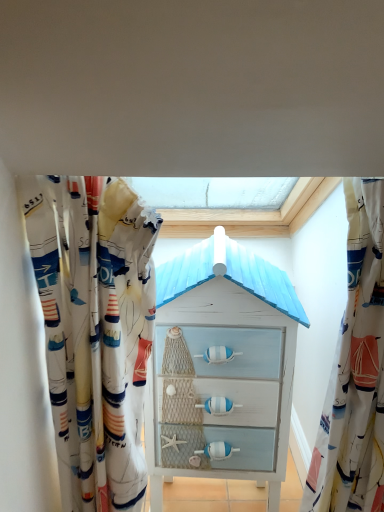
At what (x,y) coordinates should I click in order to perform the action: click on white fabric curtain at left, the 2th curtain from the right. Please return your answer as a coordinate pair (x, y). The height and width of the screenshot is (512, 384). Looking at the image, I should click on (96, 326).

Locate an element on the screen. The width and height of the screenshot is (384, 512). white painted wood chest of drawers at center is located at coordinates (x=222, y=369).

Find the location of a particular element. the chest of drawers that is below the white fabric curtain at left, the 2th curtain from the right (from the image's perspective) is located at coordinates (222, 369).

Is white fabric curtain at left, the 2th curtain from the right, outside of white painted wood chest of drawers at center?

white fabric curtain at left, the 2th curtain from the right, is positioned outside white painted wood chest of drawers at center.

From a real-world perspective, who is located higher, white fabric curtain at left, the 2th curtain from the right, or white painted wood chest of drawers at center?

In real-world perspective, white fabric curtain at left, the 2th curtain from the right, is above.

Is point (108, 297) positioned after point (202, 393)?

No, (108, 297) is closer to viewer.

Is white painted wood chest of drawers at center oriented away from white fabric curtain at left, the first curtain from the left?

No.

Looking at this image, is white fabric curtain at left, the first curtain from the left, a part of white painted wood chest of drawers at center?

That's incorrect, white fabric curtain at left, the first curtain from the left, is not inside white painted wood chest of drawers at center.

Which object is positioned more to the right, white painted wood chest of drawers at center or white fabric curtain at left, the 2th curtain from the right?

From the viewer's perspective, white painted wood chest of drawers at center appears more on the right side.

From a real-world perspective, which is physically below, white painted wood chest of drawers at center or white fabric curtain at left, the 2th curtain from the right?

white painted wood chest of drawers at center, from a real-world perspective.

Where is `curtain behind the white fabric curtain at left, the 2th curtain from the right`? curtain behind the white fabric curtain at left, the 2th curtain from the right is located at coordinates (355, 370).

From the picture: From the image's perspective, does white fabric curtain at left, the first curtain from the left, appear higher than white fabric curtain at right, the 2th curtain from the left?

Indeed, from the image's perspective, white fabric curtain at left, the first curtain from the left, is shown above white fabric curtain at right, the 2th curtain from the left.

Is point (136, 452) more distant than point (309, 495)?

No, it is not.

From the image's perspective, is white fabric curtain at right, arranged as the 1th curtain when viewed from the right, on white fabric curtain at left, the 2th curtain from the right?

No, from the image's perspective, white fabric curtain at right, arranged as the 1th curtain when viewed from the right, is not above white fabric curtain at left, the 2th curtain from the right.

Which is correct: white fabric curtain at right, arranged as the 1th curtain when viewed from the right, is inside white fabric curtain at left, the 2th curtain from the right, or outside of it?

white fabric curtain at right, arranged as the 1th curtain when viewed from the right, is spatially situated outside white fabric curtain at left, the 2th curtain from the right.

Is white fabric curtain at right, the 2th curtain from the left, at the left side of white fabric curtain at left, the 2th curtain from the right?

Incorrect, white fabric curtain at right, the 2th curtain from the left, is not on the left side of white fabric curtain at left, the 2th curtain from the right.

Between point (341, 347) and point (105, 492), which one is positioned behind?

Positioned behind is point (105, 492).

From a real-world perspective, is white fabric curtain at right, the 2th curtain from the left, positioned above or below white painted wood chest of drawers at center?

white fabric curtain at right, the 2th curtain from the left, is situated higher than white painted wood chest of drawers at center in the real world.

Which of these two, white fabric curtain at right, arranged as the 1th curtain when viewed from the right, or white painted wood chest of drawers at center, is smaller?

With smaller size is white fabric curtain at right, arranged as the 1th curtain when viewed from the right.

Where is `curtain that is the 1st one when counting forward from the white painted wood chest of drawers at center`? Image resolution: width=384 pixels, height=512 pixels. curtain that is the 1st one when counting forward from the white painted wood chest of drawers at center is located at coordinates (355, 370).

Locate an element on the screen. The width and height of the screenshot is (384, 512). curtain that is the 1st one when counting upward from the white painted wood chest of drawers at center (from the image's perspective) is located at coordinates (355, 370).

Would you consider white painted wood chest of drawers at center to be distant from white fabric curtain at right, the 2th curtain from the left?

No, there isn't a large distance between white painted wood chest of drawers at center and white fabric curtain at right, the 2th curtain from the left.

Between white painted wood chest of drawers at center and white fabric curtain at right, the 2th curtain from the left, which one has smaller size?

white fabric curtain at right, the 2th curtain from the left, is smaller.

What are the coordinates of `curtain that is the 2nd object located above the white painted wood chest of drawers at center (from the image's perspective)` in the screenshot? It's located at (96, 326).

The image size is (384, 512). In order to click on curtain on the left of white painted wood chest of drawers at center in this screenshot , I will do `click(96, 326)`.

Which object lies further to the anchor point white fabric curtain at left, the 2th curtain from the right, white painted wood chest of drawers at center or white fabric curtain at right, arranged as the 1th curtain when viewed from the right?

white fabric curtain at right, arranged as the 1th curtain when viewed from the right, is further to white fabric curtain at left, the 2th curtain from the right.

Estimate the real-world distances between objects in this image. Which object is closer to white painted wood chest of drawers at center, white fabric curtain at left, the 2th curtain from the right, or white fabric curtain at right, the 2th curtain from the left?

Based on the image, white fabric curtain at left, the 2th curtain from the right, appears to be nearer to white painted wood chest of drawers at center.

Which object lies nearer to the anchor point white fabric curtain at left, the 2th curtain from the right, white fabric curtain at right, the 2th curtain from the left, or white painted wood chest of drawers at center?

white painted wood chest of drawers at center lies closer to white fabric curtain at left, the 2th curtain from the right, than the other object.

Looking at the image, which one is located closer to white fabric curtain at right, the 2th curtain from the left, white painted wood chest of drawers at center or white fabric curtain at left, the 2th curtain from the right?

white painted wood chest of drawers at center is closer to white fabric curtain at right, the 2th curtain from the left.

From the image, which object appears to be farther from white fabric curtain at right, arranged as the 1th curtain when viewed from the right, white fabric curtain at left, the first curtain from the left, or white painted wood chest of drawers at center?

white fabric curtain at left, the first curtain from the left.

Considering their positions, is white fabric curtain at right, the 2th curtain from the left, positioned closer to white painted wood chest of drawers at center than white fabric curtain at left, the 2th curtain from the right?

white fabric curtain at left, the 2th curtain from the right, is positioned closer to the anchor white painted wood chest of drawers at center.

Identify the location of the chest of drawers situated between white fabric curtain at left, the first curtain from the left, and white fabric curtain at right, arranged as the 1th curtain when viewed from the right, from left to right. (222, 369).